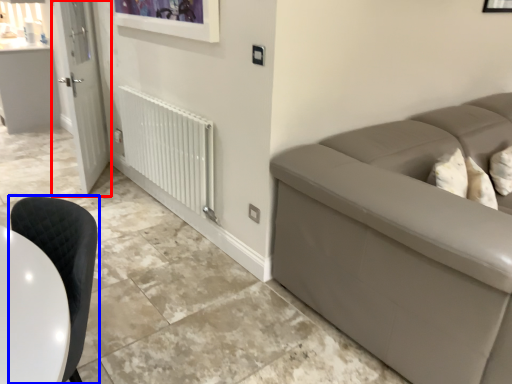
Question: Among these objects, which one is farthest to the camera, door (highlighted by a red box) or chair (highlighted by a blue box)?

Choices:
 (A) door
 (B) chair

Answer: (A)